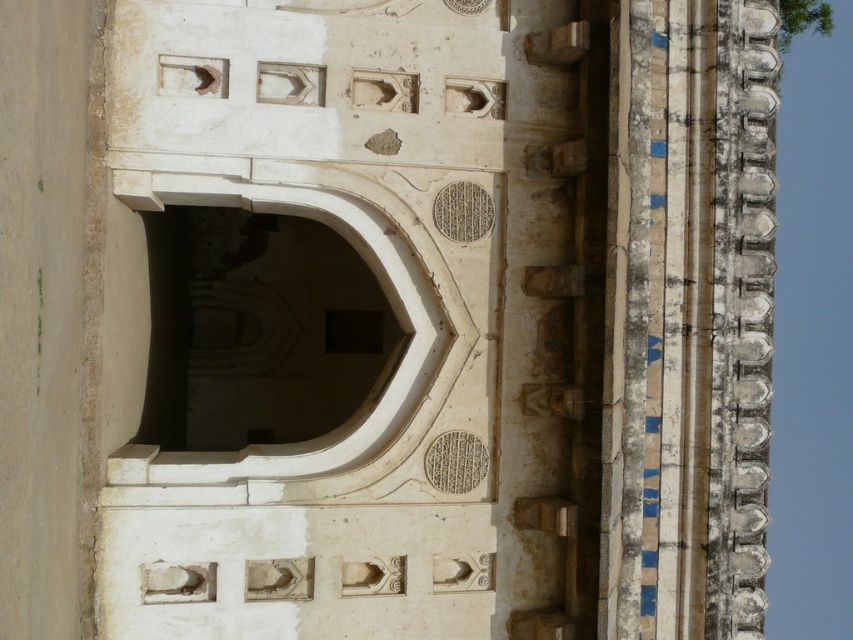
Question: Is white stone arch at upper right positioned in front of white stone archway at center?

Choices:
 (A) yes
 (B) no

Answer: (A)

Question: Is white stone arch at upper right below white stone archway at center?

Choices:
 (A) no
 (B) yes

Answer: (B)

Question: Among these objects, which one is farthest from the camera?

Choices:
 (A) white stone arch at upper right
 (B) white stone archway at center

Answer: (B)

Question: Which point is closer to the camera taking this photo?

Choices:
 (A) (680, 518)
 (B) (325, 401)

Answer: (A)

Question: Does white stone arch at upper right appear on the left side of white stone archway at center?

Choices:
 (A) no
 (B) yes

Answer: (A)